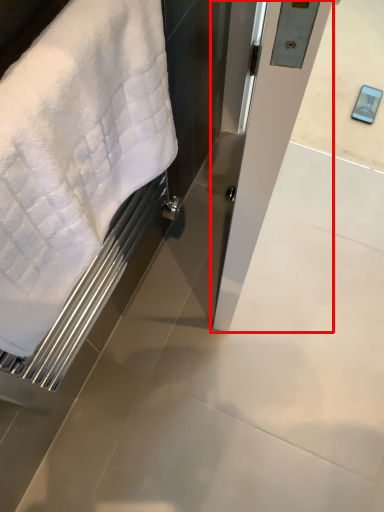
Question: From the image's perspective, where is screen door (annotated by the red box) located relative to towel?

Choices:
 (A) below
 (B) above

Answer: (B)